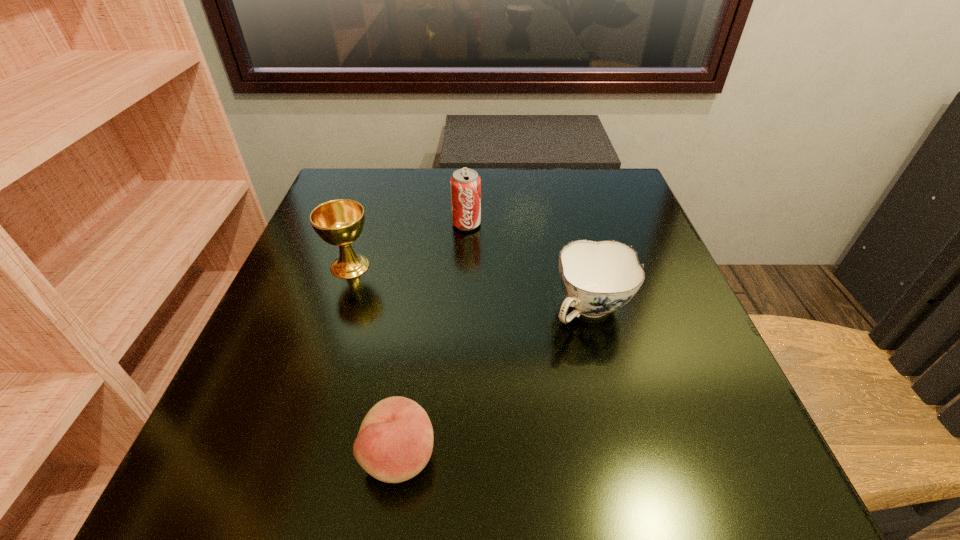
You are a GUI agent. You are given a task and a screenshot of the screen. Output one action in this format:
    pyautogui.click(x=<x>, y=<y>)
    Task: Click on the soda can
    
    Given the screenshot: What is the action you would take?
    (465, 184)

Find the location of a particular element. chalice is located at coordinates (339, 222).

Locate an element on the screen. The height and width of the screenshot is (540, 960). chinaware is located at coordinates (597, 278).

I want to click on the nearest object, so (395, 441).

Locate an element on the screen. This screenshot has height=540, width=960. free point located 0.330m on the front of the soda can is located at coordinates (462, 348).

I want to click on vacant space located on the back of the leftmost object, so click(381, 174).

You are a GUI agent. You are given a task and a screenshot of the screen. Output one action in this format:
    pyautogui.click(x=<x>, y=<y>)
    Task: Click on the free point located on the front of the chinaware
    The image size is (960, 540).
    Given the screenshot: What is the action you would take?
    pos(616,413)

The height and width of the screenshot is (540, 960). I want to click on vacant space located 0.110m on the right of the peach, so click(x=516, y=455).

Where is `object that is at the far edge`? The height and width of the screenshot is (540, 960). object that is at the far edge is located at coordinates click(465, 184).

Find the location of a particular element. This screenshot has width=960, height=540. object located in the near edge section of the desktop is located at coordinates (395, 441).